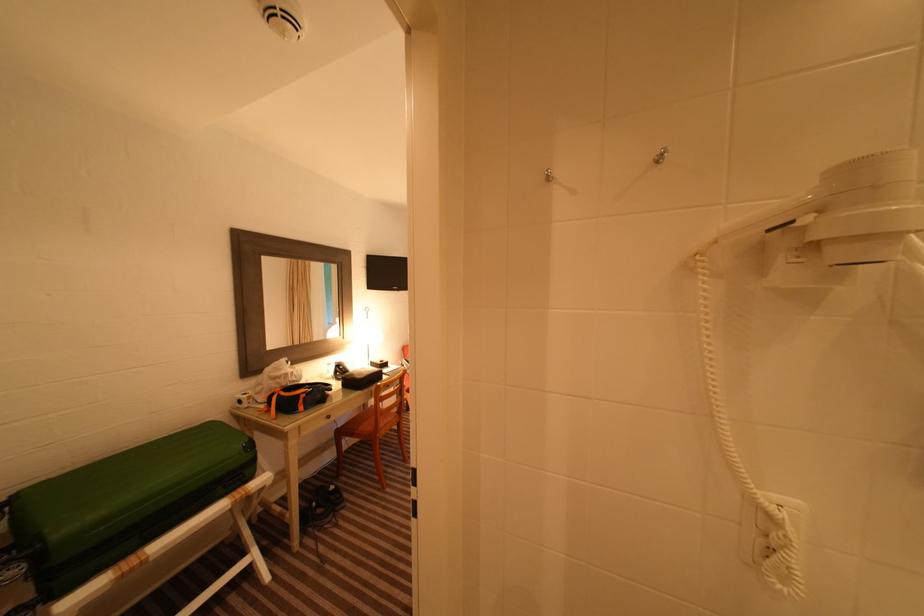
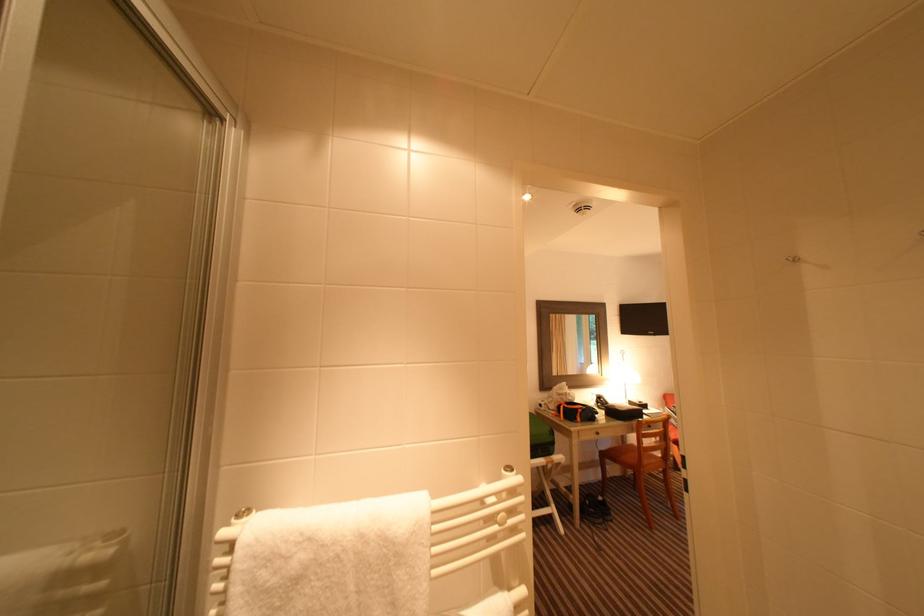
Question: The camera is either moving clockwise (left) or counter-clockwise (right) around the object. The first image is from the beginning of the video and the second image is from the end. Is the camera moving left or right when shooting the video?

Choices:
 (A) Left
 (B) Right

Answer: (B)